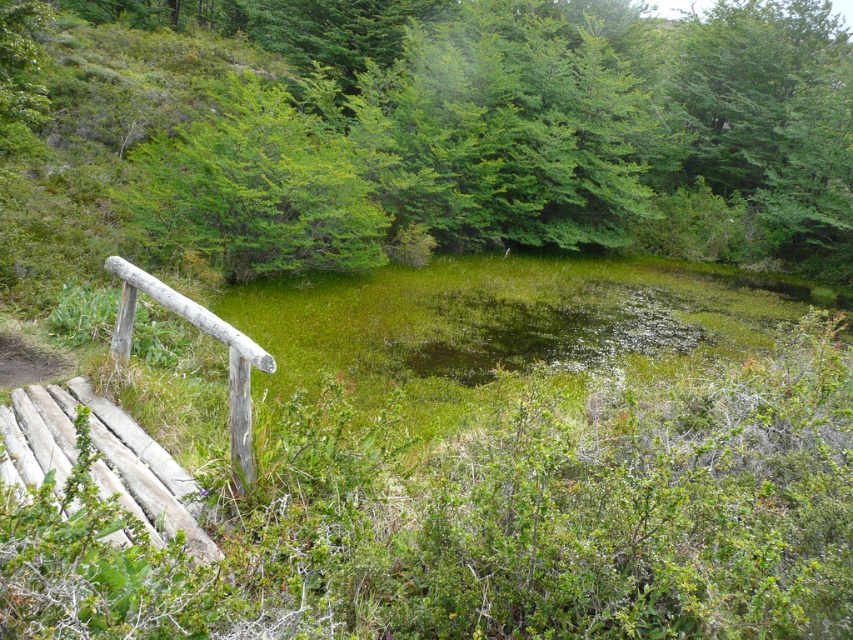
Question: Can you confirm if green leafy tree at center is wider than weathered wood rail at left?

Choices:
 (A) no
 (B) yes

Answer: (B)

Question: Which point is farther to the camera?

Choices:
 (A) green leafy tree at center
 (B) green leafy tree at upper center
 (C) weathered wood rail at left

Answer: (B)

Question: Among these points, which one is nearest to the camera?

Choices:
 (A) (788, 186)
 (B) (259, 189)

Answer: (B)

Question: Is green leafy tree at center to the left of weathered wood rail at left from the viewer's perspective?

Choices:
 (A) yes
 (B) no

Answer: (B)

Question: Considering the relative positions of green leafy tree at center and weathered wood rail at left in the image provided, where is green leafy tree at center located with respect to weathered wood rail at left?

Choices:
 (A) right
 (B) left

Answer: (A)

Question: Among these points, which one is nearest to the camera?

Choices:
 (A) (770, 244)
 (B) (113, 269)
 (C) (312, 209)

Answer: (B)